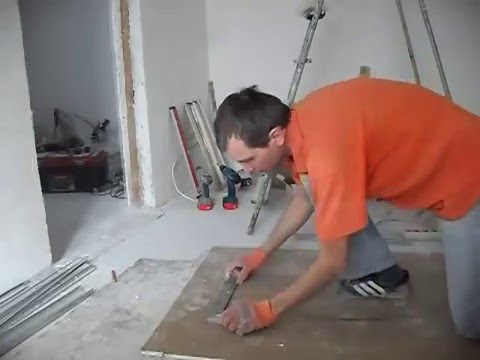
I want to click on wall, so click(144, 65).